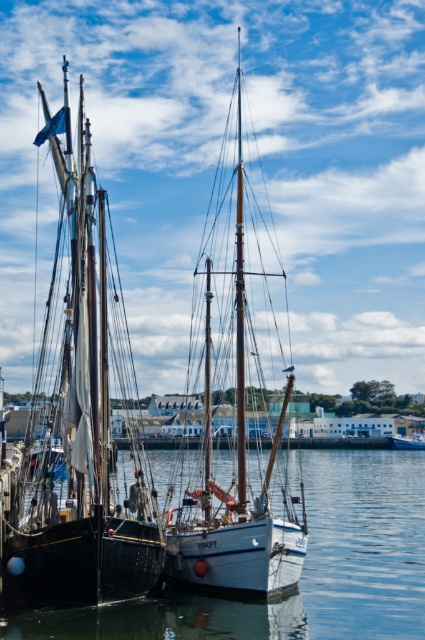
Question: Which point is farther from the camera taking this photo?

Choices:
 (A) (249, 541)
 (B) (82, 573)
 (C) (410, 445)

Answer: (C)

Question: Is matte black sailboat at left to the right of clear water at center from the viewer's perspective?

Choices:
 (A) yes
 (B) no

Answer: (B)

Question: Which object appears closest to the camera in this image?

Choices:
 (A) matte black sailboat at left
 (B) white matte sailboat at center
 (C) clear water at center
 (D) white matte boat at center

Answer: (A)

Question: Can you confirm if clear water at center is smaller than white matte boat at center?

Choices:
 (A) no
 (B) yes

Answer: (A)

Question: Which is nearer to the matte black sailboat at left?

Choices:
 (A) white matte sailboat at center
 (B) clear water at center
 (C) white matte boat at center

Answer: (A)

Question: In this image, where is white matte sailboat at center located relative to white matte boat at center?

Choices:
 (A) right
 (B) left

Answer: (B)